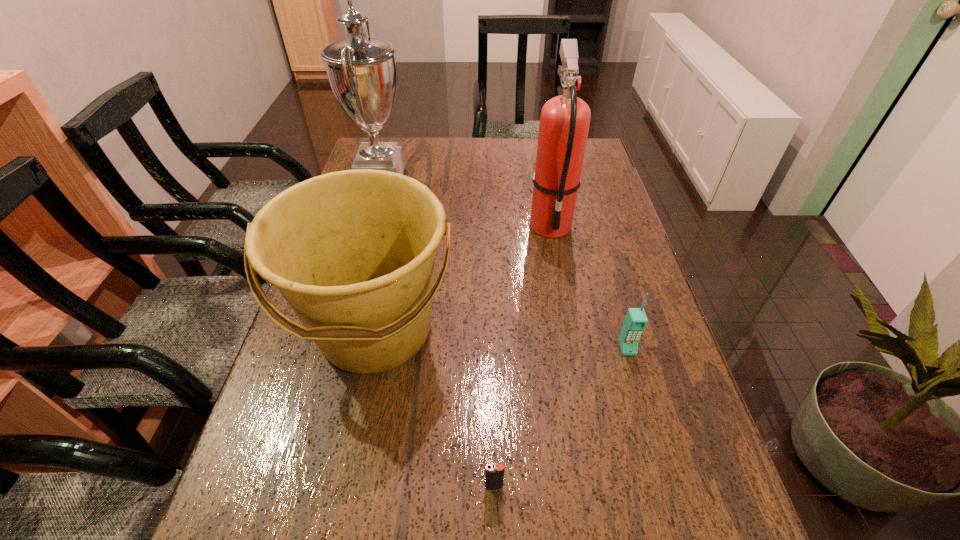
Where is `vacant space at the right edge of the desktop`? This screenshot has width=960, height=540. vacant space at the right edge of the desktop is located at coordinates (608, 176).

Locate an element on the screen. This screenshot has width=960, height=540. free area in between the second shortest object and the igniter is located at coordinates (561, 417).

This screenshot has height=540, width=960. In order to click on empty space that is in between the second object from right to left and the trophy cup in this screenshot , I will do `click(467, 208)`.

The image size is (960, 540). Identify the location of free space that is in between the rightmost object and the second object from right to left. (588, 286).

Locate an element on the screen. free space that is in between the fourth object from left to right and the igniter is located at coordinates (522, 356).

The image size is (960, 540). In order to click on empty space between the rightmost object and the trophy cup in this screenshot , I will do `click(505, 270)`.

Locate an element on the screen. The image size is (960, 540). vacant region between the shortest object and the third tallest object is located at coordinates (435, 409).

Find the location of `vacant area between the fire extinguisher and the igniter`. vacant area between the fire extinguisher and the igniter is located at coordinates (522, 356).

Image resolution: width=960 pixels, height=540 pixels. In order to click on free space between the second object from right to left and the igniter in this screenshot , I will do `click(522, 356)`.

Where is `object that ranks as the third closest to the second object from right to left`? The image size is (960, 540). object that ranks as the third closest to the second object from right to left is located at coordinates (361, 70).